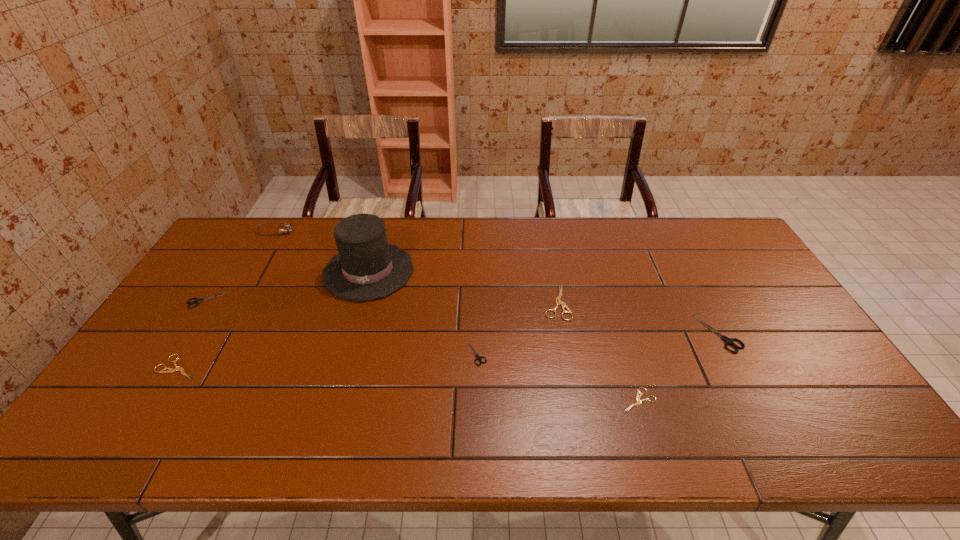
Identify the location of blank space at the left edge. (187, 348).

Identify the location of vacant area at the right edge of the desktop. (726, 267).

This screenshot has height=540, width=960. I want to click on free spot at the far left corner of the desktop, so click(x=224, y=241).

Identify the location of blank area at the far right corner. The height and width of the screenshot is (540, 960). (720, 247).

The width and height of the screenshot is (960, 540). What are the coordinates of `empty space between the leftmost beige shears and the smallest black shears` in the screenshot? It's located at (327, 360).

Image resolution: width=960 pixels, height=540 pixels. I want to click on vacant point located between the tallest shears and the dress hat, so click(x=544, y=302).

In order to click on vacant point located between the third tallest object and the nearest beige shears in this screenshot , I will do `click(679, 367)`.

Locate an element on the screen. free space between the biggest black shears and the second smallest beige shears is located at coordinates (449, 350).

You are a GUI agent. You are given a task and a screenshot of the screen. Output one action in this format:
    pyautogui.click(x=<x>, y=<y>)
    Task: Click on the vacant area between the farthest object and the sixth object from left to right
    The height and width of the screenshot is (540, 960).
    Given the screenshot: What is the action you would take?
    pyautogui.click(x=416, y=267)

The image size is (960, 540). In order to click on free space that is in between the farthest object and the second farthest beige shears in this screenshot , I will do `click(228, 299)`.